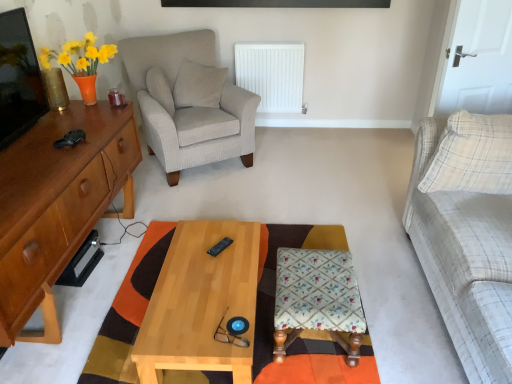
Locate an element on the screen. free area behind light wood/texture coffee table at center is located at coordinates (237, 220).